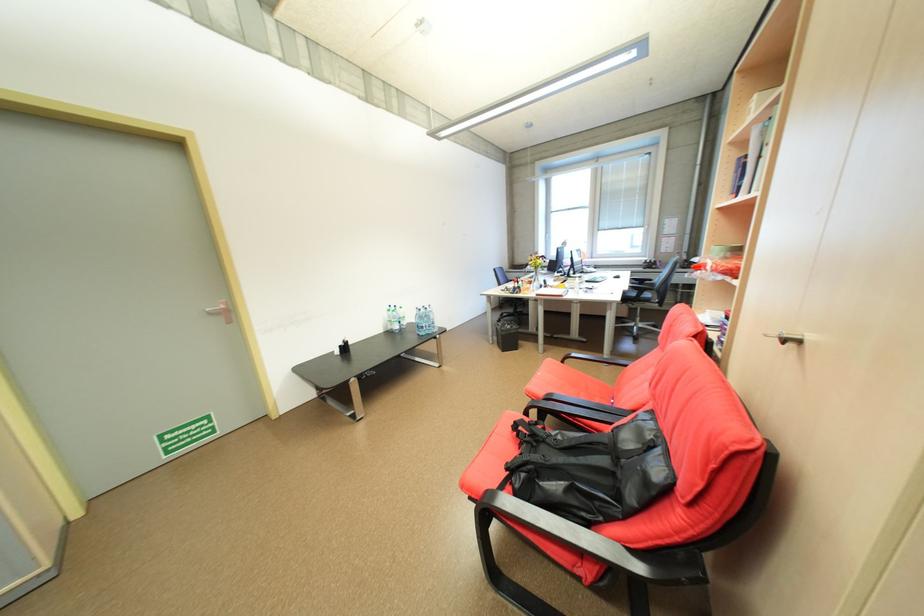
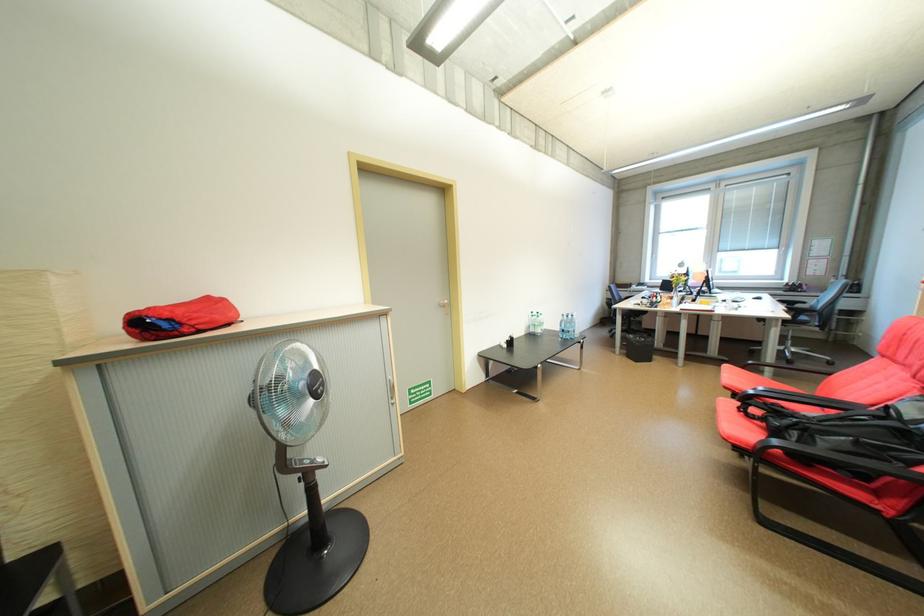
The point at (398, 328) is marked in the first image. Where is the corresponding point in the second image?

(541, 331)